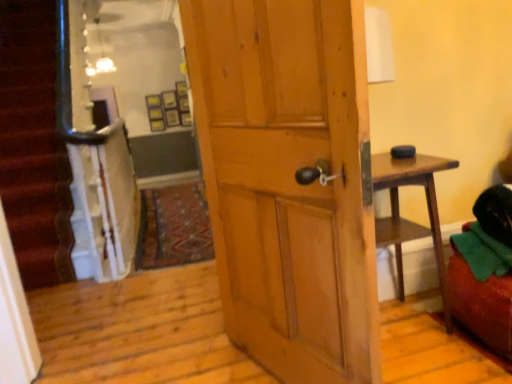
Question: Is wooden door at center positioned with its back to velvet green bean bag chair at right?

Choices:
 (A) no
 (B) yes

Answer: (B)

Question: From the image's perspective, is wooden door at center over velvet green bean bag chair at right?

Choices:
 (A) yes
 (B) no

Answer: (A)

Question: Does wooden door at center have a lesser height compared to velvet green bean bag chair at right?

Choices:
 (A) yes
 (B) no

Answer: (B)

Question: Can we say wooden door at center lies outside velvet green bean bag chair at right?

Choices:
 (A) no
 (B) yes

Answer: (B)

Question: From a real-world perspective, is wooden door at center located higher than velvet green bean bag chair at right?

Choices:
 (A) yes
 (B) no

Answer: (A)

Question: Can velvet green bean bag chair at right be found inside wooden door at center?

Choices:
 (A) yes
 (B) no

Answer: (B)

Question: Is velvet green bean bag chair at right turned away from wooden door at center?

Choices:
 (A) no
 (B) yes

Answer: (A)

Question: Is velvet green bean bag chair at right facing towards wooden door at center?

Choices:
 (A) yes
 (B) no

Answer: (B)

Question: Is velvet green bean bag chair at right to the right of wooden door at center from the viewer's perspective?

Choices:
 (A) yes
 (B) no

Answer: (A)

Question: Is wooden door at center located within velvet green bean bag chair at right?

Choices:
 (A) no
 (B) yes

Answer: (A)

Question: Considering the relative positions of velvet green bean bag chair at right and wooden door at center in the image provided, is velvet green bean bag chair at right to the left of wooden door at center from the viewer's perspective?

Choices:
 (A) yes
 (B) no

Answer: (B)

Question: Can you confirm if velvet green bean bag chair at right is bigger than wooden door at center?

Choices:
 (A) yes
 (B) no

Answer: (B)

Question: Would you say wooden door at center is inside or outside velvet green bean bag chair at right?

Choices:
 (A) inside
 (B) outside

Answer: (B)